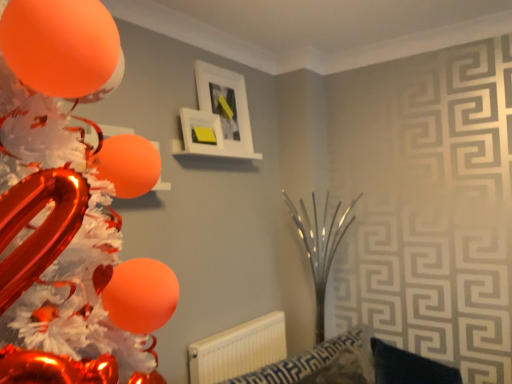
Question: From their relative heights in the image, would you say white matte picture frame at upper center, which is counted as the first picture frame, starting from the back, is taller or shorter than white matte picture frame at upper center, the 2th picture frame in the back-to-front sequence?

Choices:
 (A) tall
 (B) short

Answer: (A)

Question: Does point (227, 71) appear closer or farther from the camera than point (195, 137)?

Choices:
 (A) closer
 (B) farther

Answer: (B)

Question: Which object is the farthest from the white matte picture frame at upper center, which is counted as the first picture frame, starting from the back?

Choices:
 (A) orange glossy balloon at left
 (B) white matte picture frame at upper center, the first picture frame viewed from the front
 (C) white plastic radiator at lower center

Answer: (A)

Question: Which object is the closest to the white matte picture frame at upper center, positioned as the 2th picture frame in front-to-back order?

Choices:
 (A) orange glossy balloon at left
 (B) white plastic radiator at lower center
 (C) white matte picture frame at upper center, the 2th picture frame in the back-to-front sequence

Answer: (C)